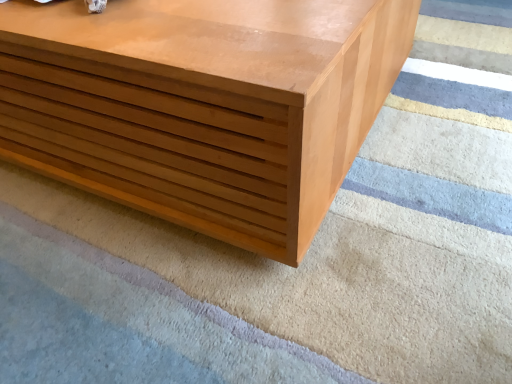
This screenshot has height=384, width=512. What do you see at coordinates (202, 105) in the screenshot? I see `matte wood chest of drawers at center` at bounding box center [202, 105].

At what (x,y) coordinates should I click in order to perform the action: click on matte wood chest of drawers at center. Please return your answer as a coordinate pair (x, y). Image resolution: width=512 pixels, height=384 pixels. Looking at the image, I should click on (202, 105).

Find the location of `matte wood chest of drawers at center`. matte wood chest of drawers at center is located at coordinates (202, 105).